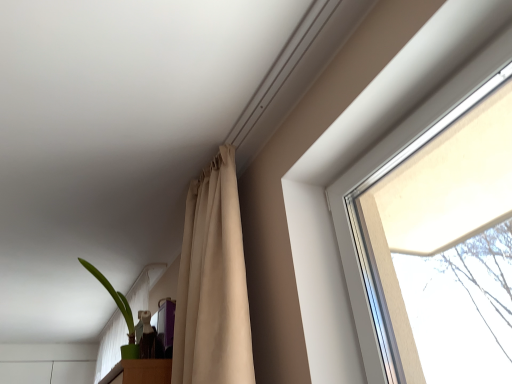
Describe the element at coordinates (122, 315) in the screenshot. I see `green matte plant pot at lower left` at that location.

Image resolution: width=512 pixels, height=384 pixels. I want to click on green matte plant pot at lower left, so click(x=122, y=315).

Measure the distance between green matte plant pot at lower left and camera.

green matte plant pot at lower left and camera are 3.11 meters apart.

At what (x,y) coordinates should I click in order to perform the action: click on beige fabric curtain at upper center. Please return your answer as a coordinate pair (x, y). Looking at the image, I should click on (213, 283).

The image size is (512, 384). Describe the element at coordinates (213, 283) in the screenshot. I see `beige fabric curtain at upper center` at that location.

Locate an element on the screen. Image resolution: width=512 pixels, height=384 pixels. green matte plant pot at lower left is located at coordinates (122, 315).

Considering the positions of objects beige fabric curtain at upper center and green matte plant pot at lower left in the image provided, who is more to the right, beige fabric curtain at upper center or green matte plant pot at lower left?

beige fabric curtain at upper center is more to the right.

Is beige fabric curtain at upper center further to camera compared to green matte plant pot at lower left?

No, the depth of beige fabric curtain at upper center is less than that of green matte plant pot at lower left.

Which is less distant, (x=195, y=301) or (x=105, y=377)?

Point (x=195, y=301) appears to be closer to the viewer than point (x=105, y=377).

From the image's perspective, which is below, beige fabric curtain at upper center or green matte plant pot at lower left?

green matte plant pot at lower left is shown below in the image.

From a real-world perspective, which object stands above the other?

From a 3D spatial view, green matte plant pot at lower left is above.

Which object is wider, beige fabric curtain at upper center or green matte plant pot at lower left?

beige fabric curtain at upper center is wider.

Looking at this image, considering the relative sizes of beige fabric curtain at upper center and green matte plant pot at lower left in the image provided, is beige fabric curtain at upper center taller than green matte plant pot at lower left?

Yes, beige fabric curtain at upper center is taller than green matte plant pot at lower left.

Considering the sizes of objects beige fabric curtain at upper center and green matte plant pot at lower left in the image provided, who is smaller, beige fabric curtain at upper center or green matte plant pot at lower left?

With smaller size is green matte plant pot at lower left.

Is beige fabric curtain at upper center inside the boundaries of green matte plant pot at lower left, or outside?

beige fabric curtain at upper center is not inside green matte plant pot at lower left, it's outside.

Are beige fabric curtain at upper center and green matte plant pot at lower left making contact?

No, beige fabric curtain at upper center is not in contact with green matte plant pot at lower left.

Does beige fabric curtain at upper center turn towards green matte plant pot at lower left?

No, beige fabric curtain at upper center is not turned towards green matte plant pot at lower left.

How different are the orientations of beige fabric curtain at upper center and green matte plant pot at lower left in degrees?

0.000527 degrees.

Identify the location of houseplant behind the beige fabric curtain at upper center. The image size is (512, 384). (122, 315).

Considering the positions of objects green matte plant pot at lower left and beige fabric curtain at upper center in the image provided, who is more to the left, green matte plant pot at lower left or beige fabric curtain at upper center?

From the viewer's perspective, green matte plant pot at lower left appears more on the left side.

Is green matte plant pot at lower left in front of beige fabric curtain at upper center?

No.

Considering the points (114, 343) and (224, 153), which point is in front, point (114, 343) or point (224, 153)?

Point (224, 153)

From the image's perspective, is green matte plant pot at lower left over beige fabric curtain at upper center?

Incorrect, from the image's perspective, green matte plant pot at lower left is lower than beige fabric curtain at upper center.

From a real-world perspective, is green matte plant pot at lower left physically located above or below beige fabric curtain at upper center?

Clearly, from a real-world perspective, green matte plant pot at lower left is above beige fabric curtain at upper center.

Looking at their sizes, would you say green matte plant pot at lower left is wider or thinner than beige fabric curtain at upper center?

green matte plant pot at lower left is thinner than beige fabric curtain at upper center.

From their relative heights in the image, would you say green matte plant pot at lower left is taller or shorter than beige fabric curtain at upper center?

green matte plant pot at lower left is shorter than beige fabric curtain at upper center.

Does green matte plant pot at lower left have a larger size compared to beige fabric curtain at upper center?

No.

Is green matte plant pot at lower left situated inside beige fabric curtain at upper center or outside?

green matte plant pot at lower left is outside beige fabric curtain at upper center.

Is green matte plant pot at lower left touching beige fabric curtain at upper center?

They are not placed beside each other.

Is green matte plant pot at lower left aimed at beige fabric curtain at upper center?

No, green matte plant pot at lower left is not aimed at beige fabric curtain at upper center.

Can you tell me how much green matte plant pot at lower left and beige fabric curtain at upper center differ in facing direction?

0.000527 degrees.

Locate an element on the screen. This screenshot has width=512, height=384. curtain below the green matte plant pot at lower left (from a real-world perspective) is located at coordinates 213,283.

The height and width of the screenshot is (384, 512). Identify the location of curtain above the green matte plant pot at lower left (from the image's perspective). (213, 283).

Image resolution: width=512 pixels, height=384 pixels. I want to click on curtain directly beneath the green matte plant pot at lower left (from a real-world perspective), so click(213, 283).